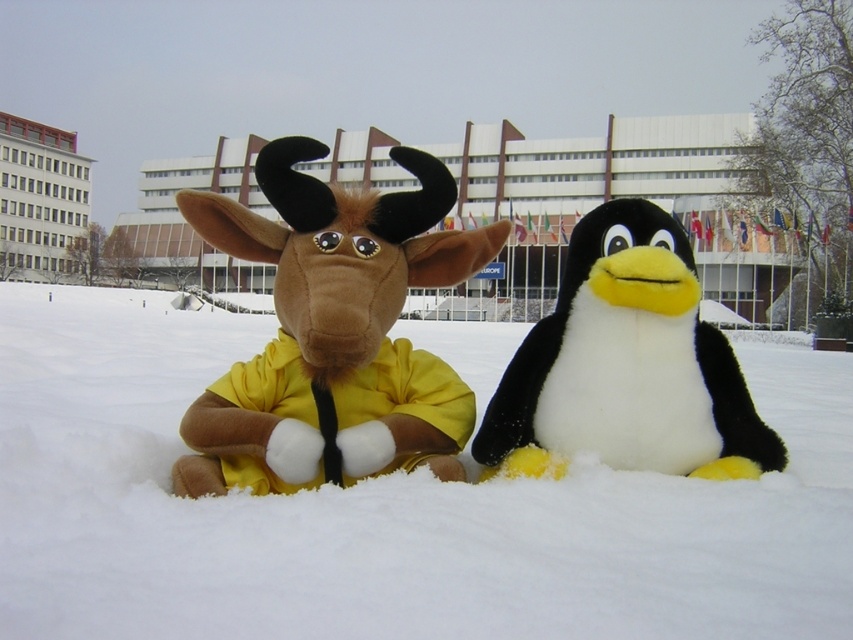
Question: Can you confirm if fuzzy brown plush at center is thinner than black plush penguin at center?

Choices:
 (A) yes
 (B) no

Answer: (B)

Question: Among these points, which one is nearest to the camera?

Choices:
 (A) [421, 477]
 (B) [579, 257]
 (C) [358, 237]

Answer: (A)

Question: Which is nearer to the white fluffy snow at center?

Choices:
 (A) fuzzy brown plush at center
 (B) black plush penguin at center

Answer: (A)

Question: Can you confirm if white fluffy snow at center is positioned above black plush penguin at center?

Choices:
 (A) yes
 (B) no

Answer: (A)

Question: Considering the real-world distances, which object is closest to the fuzzy brown plush at center?

Choices:
 (A) white fluffy snow at center
 (B) black plush penguin at center

Answer: (B)

Question: Can you confirm if white fluffy snow at center is wider than fuzzy brown plush at center?

Choices:
 (A) no
 (B) yes

Answer: (B)